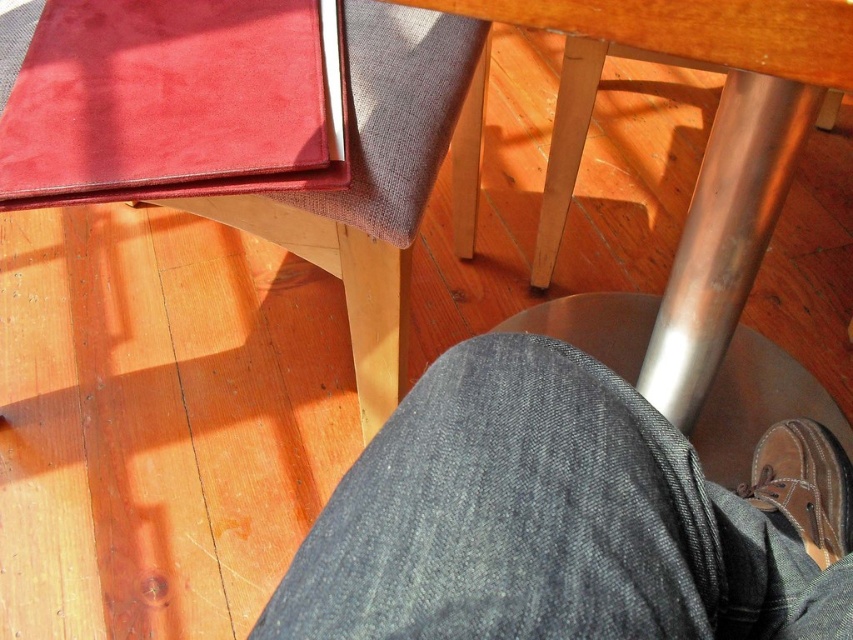
Is dark blue denim jeans at lower center smaller than brown leather shoe at lower right?

No, dark blue denim jeans at lower center is not smaller than brown leather shoe at lower right.

Which is behind, point (512, 589) or point (848, 490)?

Point (848, 490)

Identify the location of dark blue denim jeans at lower center. This screenshot has width=853, height=640. (566, 518).

Is point (18, 168) closer to viewer compared to point (834, 500)?

Yes, point (18, 168) is in front of point (834, 500).

Who is higher up, suede-like red pad at upper left or brown leather shoe at lower right?

Positioned higher is suede-like red pad at upper left.

Where is `suede-like red pad at upper left`? This screenshot has width=853, height=640. suede-like red pad at upper left is located at coordinates (175, 100).

Between point (555, 397) and point (300, 145), which one is positioned in front?

Point (555, 397) is more forward.

Is dark blue denim jeans at lower center bigger than suede-like red pad at upper left?

Correct, dark blue denim jeans at lower center is larger in size than suede-like red pad at upper left.

Identify the location of dark blue denim jeans at lower center. (566, 518).